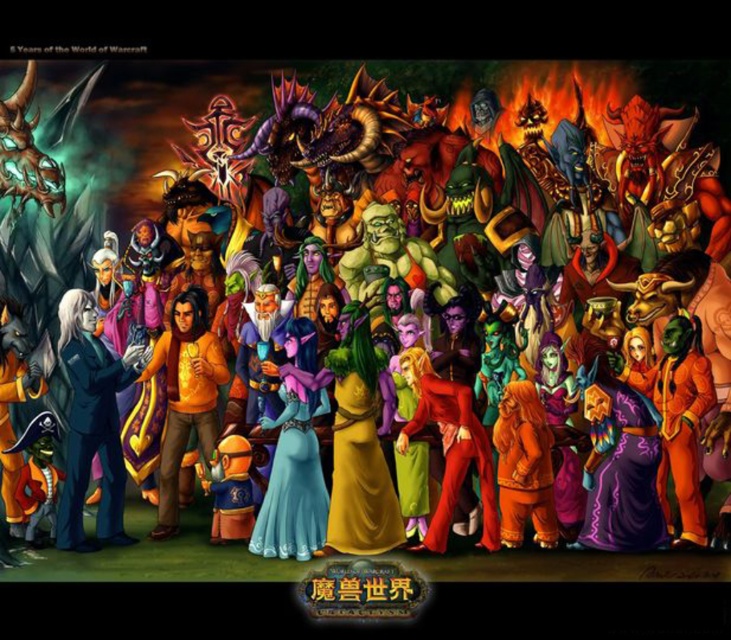
You are a game developer analyzing the character outfits in the image. Which character outfit, the smooth blue suit at left or the orange cotton sweater at center, appears taller?

The smooth blue suit at left appears taller than the orange cotton sweater at center.

Where is the orange cotton sweater at center located in the image?

The orange cotton sweater at center is located at point [185,396].